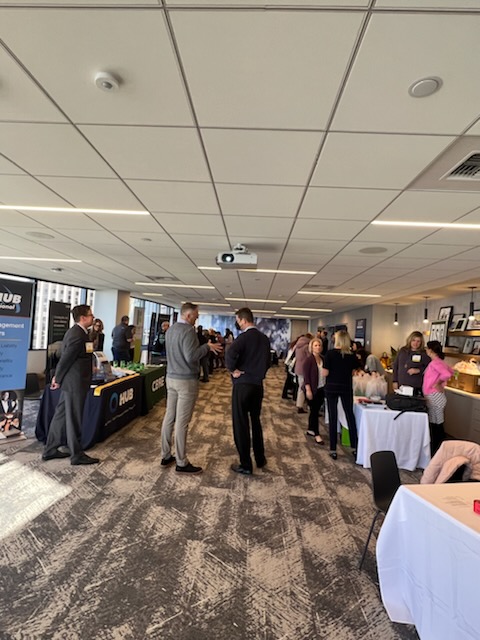
This screenshot has height=640, width=480. I want to click on white carpet, so click(x=273, y=573).